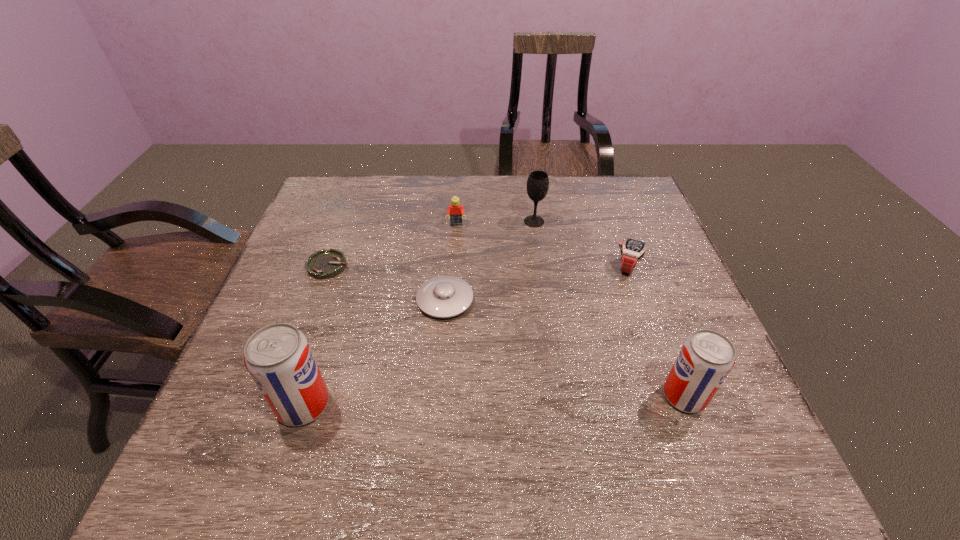
Where is `the left soda`? the left soda is located at coordinates (278, 357).

I want to click on the tallest object, so click(278, 357).

Where is `the right soda`? Image resolution: width=960 pixels, height=540 pixels. the right soda is located at coordinates (706, 358).

At what (x,y) coordinates should I click in order to perform the action: click on Lego. Please return your answer as a coordinate pair (x, y). This screenshot has height=540, width=960. Looking at the image, I should click on (455, 210).

At what (x,y) coordinates should I click in order to perform the action: click on ashtray. Please return your answer as a coordinate pair (x, y). This screenshot has width=960, height=540. Looking at the image, I should click on pyautogui.click(x=323, y=264).

Find the location of a particular element. The width and height of the screenshot is (960, 540). wineglass is located at coordinates [x=538, y=182].

Identify the location of the third shortest object. This screenshot has width=960, height=540. tap(632, 251).

Identify the location of the second shortest object. (445, 296).

The image size is (960, 540). I want to click on the fifth farthest object, so click(x=445, y=296).

Locate an element on the screen. Image resolution: width=960 pixels, height=540 pixels. vacant space located on the right of the tallest object is located at coordinates (375, 404).